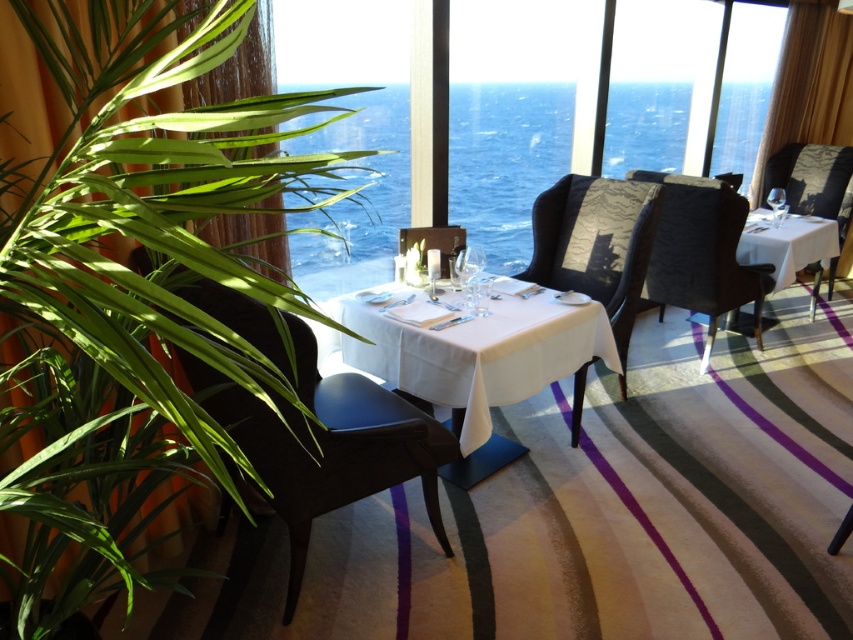
Question: Considering the relative positions of transparent glass window at center and dark gray fabric chair at center in the image provided, where is transparent glass window at center located with respect to dark gray fabric chair at center?

Choices:
 (A) right
 (B) left

Answer: (B)

Question: Does dark brown leather chair at left appear over clear glass wine glass at center?

Choices:
 (A) no
 (B) yes

Answer: (A)

Question: Which is farther from the green leafy plant at left?

Choices:
 (A) dark brown leather chair at left
 (B) velvet dark brown chair at right
 (C) white linen table at center
 (D) transparent glass window at center

Answer: (B)

Question: Which point appears farthest from the camera in this image?

Choices:
 (A) (465, 358)
 (B) (564, 248)
 (C) (466, 296)

Answer: (B)

Question: Does satin black chair at center appear under clear glass wine glass at center?

Choices:
 (A) no
 (B) yes

Answer: (A)

Question: Which object is farther from the camera taking this photo?

Choices:
 (A) green leafy plant at left
 (B) transparent glass wine glass at center
 (C) white linen table at center
 (D) white cloth at center

Answer: (B)